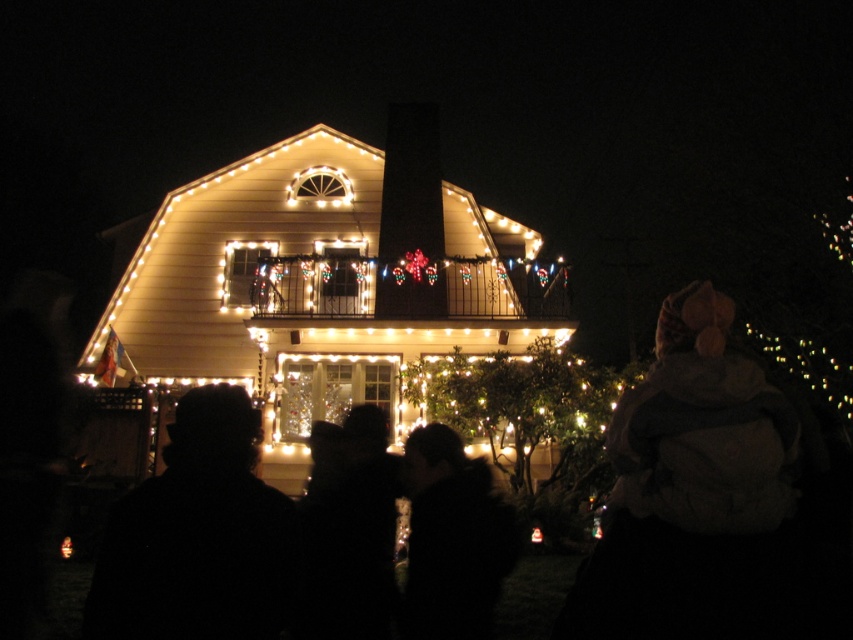
Question: Which point appears closest to the camera in this image?

Choices:
 (A) (209, 499)
 (B) (473, 632)

Answer: (A)

Question: Which object appears closest to the camera in this image?

Choices:
 (A) silhouette of person at center
 (B) black fuzzy hat at center

Answer: (B)

Question: Can you confirm if black fuzzy hat at center is smaller than silhouette of person at center?

Choices:
 (A) yes
 (B) no

Answer: (B)

Question: Is the position of black fuzzy hat at center less distant than that of silhouette of person at center?

Choices:
 (A) yes
 (B) no

Answer: (A)

Question: Can you confirm if black fuzzy hat at center is thinner than silhouette of person at center?

Choices:
 (A) yes
 (B) no

Answer: (B)